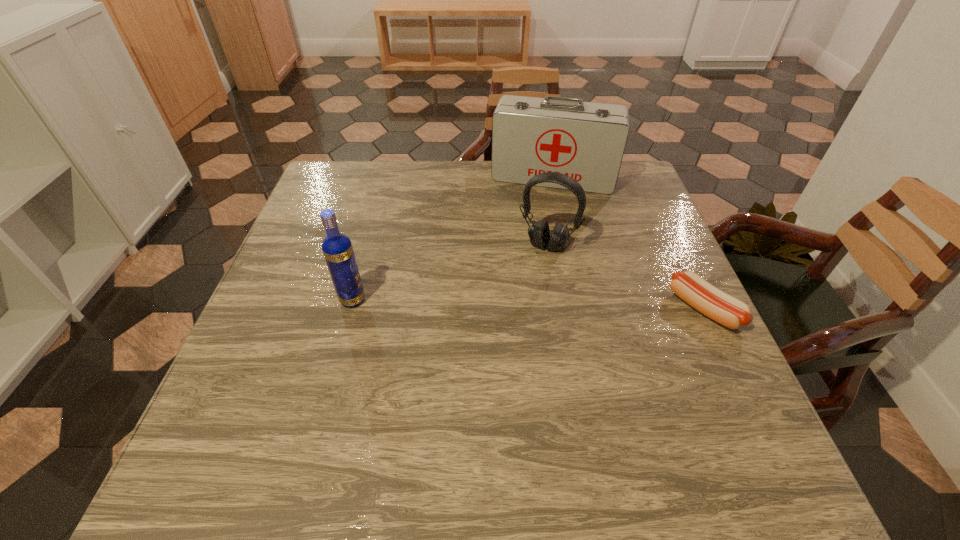
Locate an element on the screen. the leftmost object is located at coordinates (337, 248).

Where is `the rightmost object`? The height and width of the screenshot is (540, 960). the rightmost object is located at coordinates (728, 311).

Where is `the shortest object`? the shortest object is located at coordinates (728, 311).

Find the location of a particular element. the second farthest object is located at coordinates (539, 233).

At what (x,y) coordinates should I click in order to perform the action: click on the farthest object. Please return your answer as a coordinate pair (x, y). The height and width of the screenshot is (540, 960). Looking at the image, I should click on (586, 141).

Locate an element on the screen. free space located on the back of the leftmost object is located at coordinates (361, 269).

At what (x,y) coordinates should I click in order to perform the action: click on free spot located 0.270m on the back of the shortest object. Please return your answer as a coordinate pair (x, y). The width and height of the screenshot is (960, 540). Looking at the image, I should click on (658, 212).

Find the location of a particular element. The height and width of the screenshot is (540, 960). free space located 0.160m on the front-facing side of the third nearest object is located at coordinates (517, 301).

Identify the location of vacant space located 0.140m on the front-facing side of the third nearest object. The image size is (960, 540). (520, 295).

Locate an element on the screen. free space located 0.140m on the front-facing side of the third nearest object is located at coordinates (520, 295).